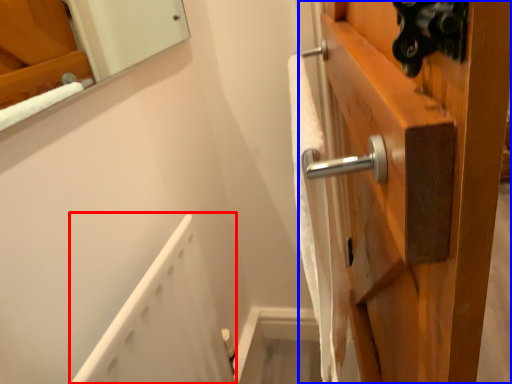
Question: Which of the following is the closest to the observer, bath (highlighted by a red box) or door (highlighted by a blue box)?

Choices:
 (A) bath
 (B) door

Answer: (A)